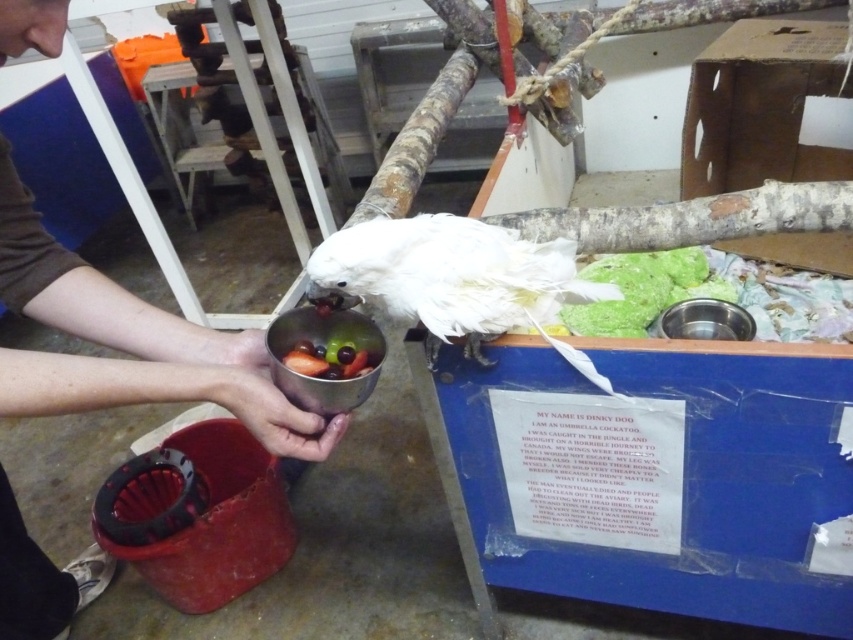
Question: Is smooth skin hand at lower left further to the viewer compared to metallic silver bowl at center?

Choices:
 (A) no
 (B) yes

Answer: (A)

Question: Among these points, which one is farthest from the camera?

Choices:
 (A) (306, 408)
 (B) (402, 228)
 (C) (273, 400)
 (D) (42, 51)

Answer: (A)

Question: Which of the following is the closest to the observer?

Choices:
 (A) (695, 316)
 (B) (230, 369)

Answer: (B)

Question: Among these points, which one is farthest from the camera?

Choices:
 (A) (711, 332)
 (B) (546, 316)
 (C) (268, 408)

Answer: (A)

Question: Is white feathered bird at center behind matte silver cup at lower center?

Choices:
 (A) no
 (B) yes

Answer: (B)

Question: Can you confirm if smooth skin hand at lower left is positioned below stainless steel bowl at center?

Choices:
 (A) no
 (B) yes

Answer: (B)